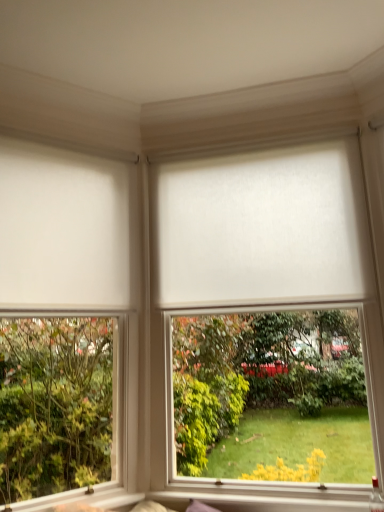
Question: Is white matte roller blind at center, positioned as the 2th window in left-to-right order, directly adjacent to white matte blind at left, the first blind viewed from the left?

Choices:
 (A) yes
 (B) no

Answer: (B)

Question: Is white matte blind at left, positioned as the 2th blind in right-to-left order, surrounded by white matte roller blind at center, positioned as the 2th window in left-to-right order?

Choices:
 (A) yes
 (B) no

Answer: (B)

Question: From a real-world perspective, is white matte roller blind at center, positioned as the 2th window in left-to-right order, positioned over white matte blind at left, positioned as the 2th blind in right-to-left order, based on gravity?

Choices:
 (A) no
 (B) yes

Answer: (A)

Question: Is white matte roller blind at center, positioned as the 2th window in left-to-right order, to the left of white matte blind at left, the first blind viewed from the left, from the viewer's perspective?

Choices:
 (A) no
 (B) yes

Answer: (A)

Question: Considering the relative sizes of white matte roller blind at center, positioned as the 2th window in left-to-right order, and white matte blind at left, the first blind viewed from the left, in the image provided, is white matte roller blind at center, positioned as the 2th window in left-to-right order, wider than white matte blind at left, the first blind viewed from the left,?

Choices:
 (A) yes
 (B) no

Answer: (A)

Question: Is white matte roller blind at center, positioned as the 1th window in right-to-left order, bigger or smaller than white matte roller blind at left, the second window positioned from the right?

Choices:
 (A) small
 (B) big

Answer: (B)

Question: Is white matte roller blind at center, positioned as the 1th window in right-to-left order, spatially inside white matte roller blind at left, the second window positioned from the right, or outside of it?

Choices:
 (A) inside
 (B) outside

Answer: (B)

Question: In the image, is white matte roller blind at center, positioned as the 2th window in left-to-right order, positioned in front of or behind white matte roller blind at left, the second window positioned from the right?

Choices:
 (A) front
 (B) behind

Answer: (B)

Question: Is white matte roller blind at center, positioned as the 2th window in left-to-right order, taller or shorter than white matte roller blind at left, which ranks as the 1th window in left-to-right order?

Choices:
 (A) tall
 (B) short

Answer: (B)

Question: From a real-world perspective, is white matte blind at left, positioned as the 2th blind in right-to-left order, above or below white matte roller blind at center, positioned as the 2th window in left-to-right order?

Choices:
 (A) above
 (B) below

Answer: (A)

Question: Is white matte blind at left, the first blind viewed from the left, wider or thinner than white matte roller blind at center, positioned as the 2th window in left-to-right order?

Choices:
 (A) wide
 (B) thin

Answer: (B)

Question: Considering the positions of white matte blind at left, the first blind viewed from the left, and white matte roller blind at center, positioned as the 1th window in right-to-left order, in the image, is white matte blind at left, the first blind viewed from the left, taller or shorter than white matte roller blind at center, positioned as the 1th window in right-to-left order,?

Choices:
 (A) short
 (B) tall

Answer: (A)

Question: Is point (11, 233) closer or farther from the camera than point (274, 429)?

Choices:
 (A) farther
 (B) closer

Answer: (B)

Question: Is white matte roller blind at center, positioned as the 2th window in left-to-right order, inside or outside of white matte blind at left, the first blind viewed from the left?

Choices:
 (A) inside
 (B) outside

Answer: (B)

Question: Is white matte roller blind at center, positioned as the 1th window in right-to-left order, taller or shorter than white matte blind at left, the first blind viewed from the left?

Choices:
 (A) tall
 (B) short

Answer: (A)